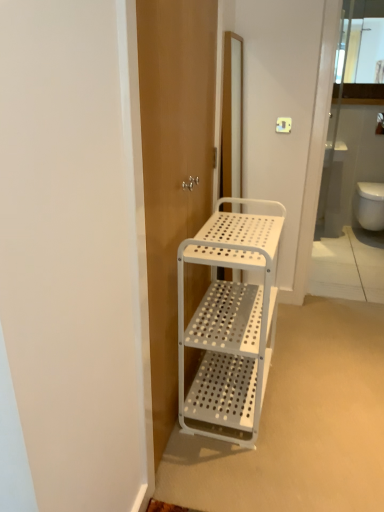
Where is `white glossy toilet bowl at lower right`? This screenshot has width=384, height=512. white glossy toilet bowl at lower right is located at coordinates tap(369, 205).

Describe the element at coordinates (230, 323) in the screenshot. I see `white perforated metal cart at center` at that location.

Find the location of a particular element. The image size is (384, 512). white perforated cabinet at upper center is located at coordinates (361, 51).

Between white perforated screen door at center and white glossy toilet bowl at lower right, which one has more height?

Standing taller between the two is white perforated screen door at center.

From the image's perspective, which is below, white perforated screen door at center or white glossy toilet bowl at lower right?

From the image's view, white perforated screen door at center is below.

Based on the photo, between white perforated screen door at center and white glossy toilet bowl at lower right, which one has larger size?

white perforated screen door at center is bigger.

The width and height of the screenshot is (384, 512). Find the location of `toilet bowl that is above the white perforated screen door at center (from the image's perspective)`. toilet bowl that is above the white perforated screen door at center (from the image's perspective) is located at coordinates (369, 205).

Looking at this image, which object is positioned more to the right, white perforated screen door at center or white perforated cabinet at upper center?

white perforated cabinet at upper center is more to the right.

From a real-world perspective, is white perforated screen door at center above or below white perforated cabinet at upper center?

In terms of real-world spatial position, white perforated screen door at center is below white perforated cabinet at upper center.

Identify the location of screen door in front of the white perforated cabinet at upper center. This screenshot has height=512, width=384. (173, 169).

Does white perforated screen door at center have a larger size compared to white perforated cabinet at upper center?

Yes, white perforated screen door at center is bigger than white perforated cabinet at upper center.

In the scene shown: Is white perforated metal cart at center inside white perforated cabinet at upper center?

No, white perforated metal cart at center is not surrounded by white perforated cabinet at upper center.

From the image's perspective, is white perforated cabinet at upper center positioned above or below white perforated metal cart at center?

Based on their image positions, white perforated cabinet at upper center is located above white perforated metal cart at center.

Is white perforated cabinet at upper center taller than white perforated metal cart at center?

Incorrect, the height of white perforated cabinet at upper center is not larger of that of white perforated metal cart at center.

Which of these two, white perforated cabinet at upper center or white perforated metal cart at center, is thinner?

white perforated cabinet at upper center.

Could you measure the distance between white glossy toilet bowl at lower right and white perforated cabinet at upper center?

white glossy toilet bowl at lower right and white perforated cabinet at upper center are 1.04 meters apart.

Would you say white glossy toilet bowl at lower right is inside or outside white perforated cabinet at upper center?

white glossy toilet bowl at lower right is outside white perforated cabinet at upper center.

From a real-world perspective, does white glossy toilet bowl at lower right stand above white perforated cabinet at upper center?

No, from a real-world perspective, white glossy toilet bowl at lower right is not over white perforated cabinet at upper center

Considering the relative sizes of white glossy toilet bowl at lower right and white perforated metal cart at center in the image provided, is white glossy toilet bowl at lower right smaller than white perforated metal cart at center?

Correct, white glossy toilet bowl at lower right occupies less space than white perforated metal cart at center.

Is white glossy toilet bowl at lower right wider or thinner than white perforated metal cart at center?

In the image, white glossy toilet bowl at lower right appears to be wider than white perforated metal cart at center.

From a real-world perspective, relative to white perforated metal cart at center, is white glossy toilet bowl at lower right vertically above or below?

From a real-world perspective, white glossy toilet bowl at lower right is physically below white perforated metal cart at center.

Considering the sizes of white glossy toilet bowl at lower right and white perforated metal cart at center in the image, is white glossy toilet bowl at lower right taller or shorter than white perforated metal cart at center?

Considering their sizes, white glossy toilet bowl at lower right has less height than white perforated metal cart at center.

Considering the sizes of objects white perforated metal cart at center and white perforated cabinet at upper center in the image provided, who is thinner, white perforated metal cart at center or white perforated cabinet at upper center?

Thinner between the two is white perforated cabinet at upper center.

Does white perforated metal cart at center have a larger size compared to white perforated cabinet at upper center?

Indeed, white perforated metal cart at center has a larger size compared to white perforated cabinet at upper center.

Considering the sizes of white perforated metal cart at center and white perforated cabinet at upper center in the image, is white perforated metal cart at center taller or shorter than white perforated cabinet at upper center?

In the image, white perforated metal cart at center appears to be taller than white perforated cabinet at upper center.

Can you confirm if white perforated metal cart at center is bigger than white glossy toilet bowl at lower right?

Indeed, white perforated metal cart at center has a larger size compared to white glossy toilet bowl at lower right.

Is white perforated metal cart at center at the right side of white glossy toilet bowl at lower right?

No, white perforated metal cart at center is not to the right of white glossy toilet bowl at lower right.

Looking at this image, from a real-world perspective, is white perforated metal cart at center physically below white glossy toilet bowl at lower right?

No, from a real-world perspective, white perforated metal cart at center is not below white glossy toilet bowl at lower right.

Does point (226, 375) come closer to viewer compared to point (381, 226)?

Yes, it is in front of point (381, 226).

This screenshot has height=512, width=384. What are the coordinates of `toilet bowl that appears above the white perforated screen door at center (from the image's perspective)` in the screenshot? It's located at pos(369,205).

Identify the location of screen door in front of the white perforated cabinet at upper center. The image size is (384, 512). (173, 169).

Considering their positions, is white glossy toilet bowl at lower right positioned closer to white perforated screen door at center than white perforated cabinet at upper center?

The object closer to white perforated screen door at center is white glossy toilet bowl at lower right.

Estimate the real-world distances between objects in this image. Which object is further from white glossy toilet bowl at lower right, white perforated metal cart at center or white perforated screen door at center?

Among the two, white perforated screen door at center is located further to white glossy toilet bowl at lower right.

Looking at the image, which one is located closer to white perforated cabinet at upper center, white perforated metal cart at center or white glossy toilet bowl at lower right?

white glossy toilet bowl at lower right is positioned closer to the anchor white perforated cabinet at upper center.

From the image, which object appears to be farther from white glossy toilet bowl at lower right, white perforated cabinet at upper center or white perforated screen door at center?

white perforated screen door at center is positioned further to the anchor white glossy toilet bowl at lower right.

Which object lies nearer to the anchor point white perforated cabinet at upper center, white perforated screen door at center or white glossy toilet bowl at lower right?

Among the two, white glossy toilet bowl at lower right is located nearer to white perforated cabinet at upper center.

Considering their positions, is white perforated metal cart at center positioned further to white glossy toilet bowl at lower right than white perforated cabinet at upper center?

white perforated metal cart at center is further to white glossy toilet bowl at lower right.

From the image, which object appears to be nearer to white perforated screen door at center, white glossy toilet bowl at lower right or white perforated metal cart at center?

white perforated metal cart at center is positioned closer to the anchor white perforated screen door at center.

From the picture: Considering their positions, is white perforated screen door at center positioned closer to white glossy toilet bowl at lower right than white perforated metal cart at center?

white perforated metal cart at center is closer to white glossy toilet bowl at lower right.

The height and width of the screenshot is (512, 384). I want to click on cabinet located between white perforated screen door at center and white glossy toilet bowl at lower right in the depth direction, so click(361, 51).

The image size is (384, 512). I want to click on furniture between white perforated screen door at center and white perforated cabinet at upper center along the z-axis, so click(230, 323).

Where is `cabinet between white perforated metal cart at center and white glossy toilet bowl at lower right along the z-axis`? This screenshot has height=512, width=384. cabinet between white perforated metal cart at center and white glossy toilet bowl at lower right along the z-axis is located at coordinates (361, 51).

This screenshot has width=384, height=512. Identify the location of furniture between white perforated screen door at center and white glossy toilet bowl at lower right along the z-axis. (230, 323).